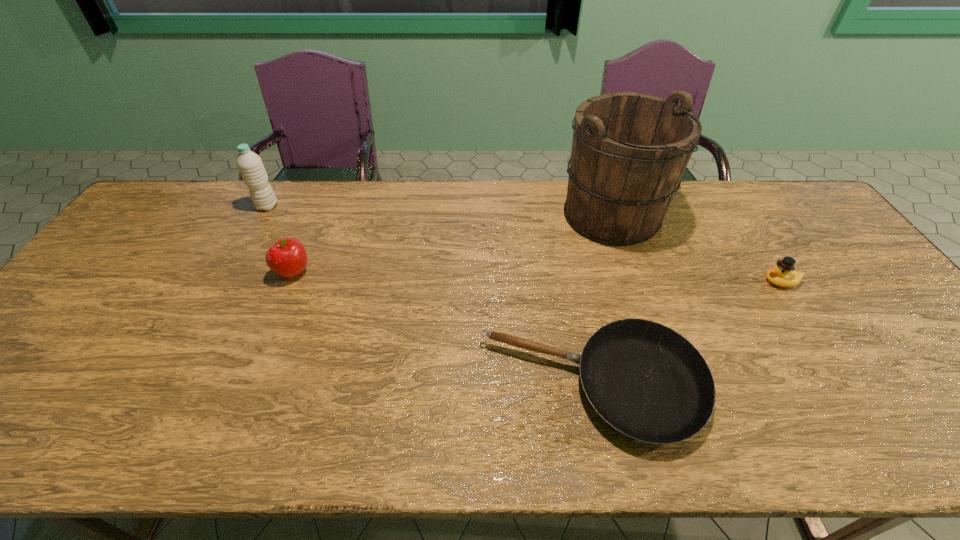
Identify which object is the third closest to the bucket. Please provide its 2D coordinates. Your answer should be formatted as a tuple, i.e. [(x, y)], where the tuple contains the x and y coordinates of a point satisfying the conditions above.

[(287, 258)]

Locate which object ranks in proximity to the nearest object. Please provide its 2D coordinates. Your answer should be formatted as a tuple, i.e. [(x, y)], where the tuple contains the x and y coordinates of a point satisfying the conditions above.

[(629, 151)]

Find the location of a particular element. free space in the image that satisfies the following two spatial constraints: 1. on the front side of the leftmost object; 2. on the right side of the fourth object from right to left is located at coordinates (231, 273).

Identify the location of vacant position in the image that satisfies the following two spatial constraints: 1. on the front side of the third tallest object; 2. on the right side of the fourth shortest object. (231, 273).